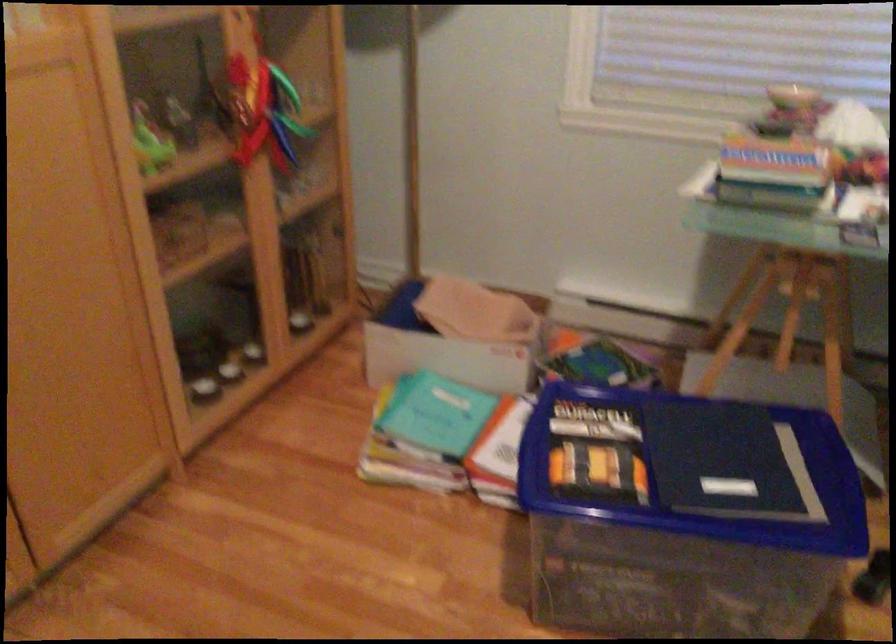
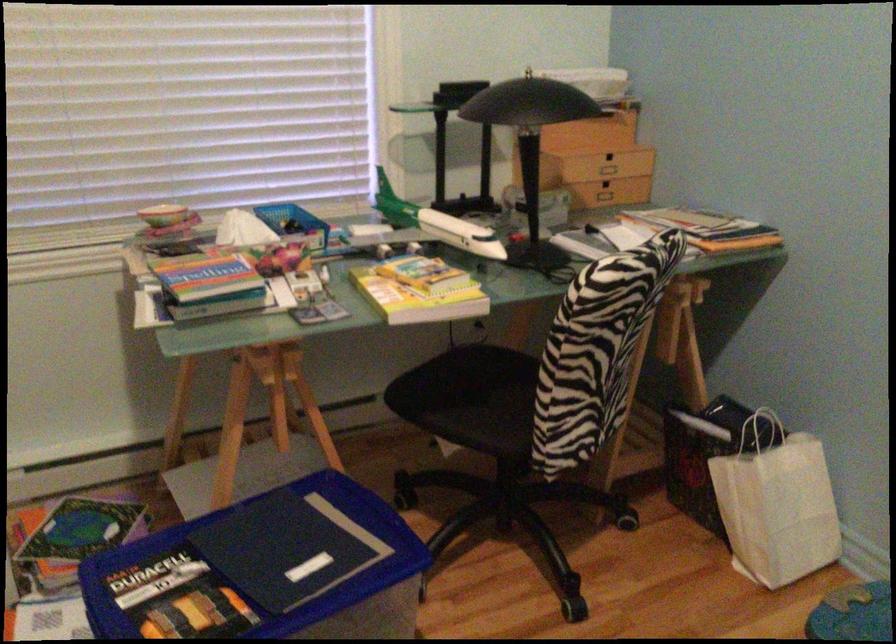
Find the pixel in the second image that matches the point at 799,95 in the first image.

(164, 214)